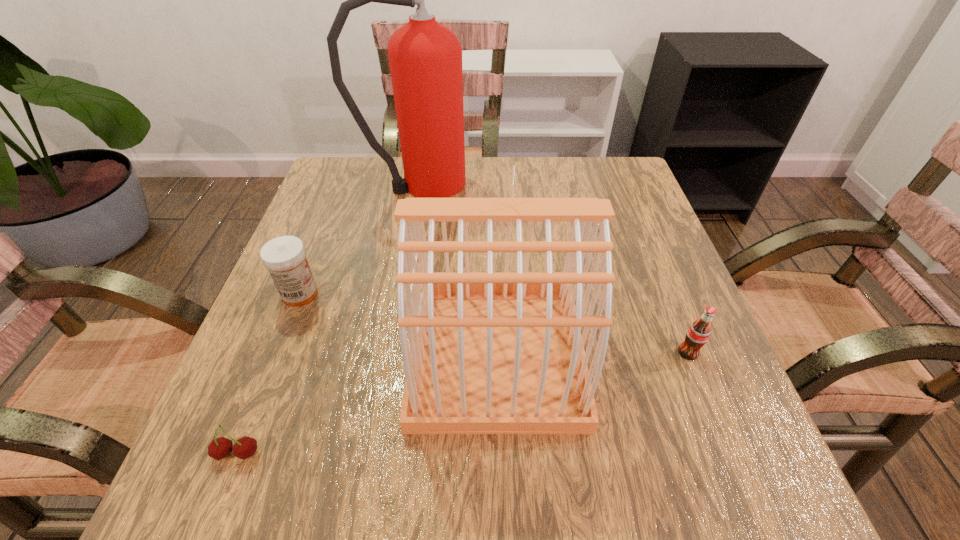
Where is `empty space between the soda and the second tallest object`? This screenshot has width=960, height=540. empty space between the soda and the second tallest object is located at coordinates click(x=592, y=354).

What are the coordinates of `vacant space that's between the medicine and the fire extinguisher` in the screenshot? It's located at (360, 239).

This screenshot has width=960, height=540. Find the location of `free spot between the rightmost object and the birdcage`. free spot between the rightmost object and the birdcage is located at coordinates (592, 354).

The width and height of the screenshot is (960, 540). What are the coordinates of `object that is the third closest to the medicine` in the screenshot? It's located at (425, 57).

Identify the location of object that is the third closest to the rightmost object. (285, 257).

This screenshot has height=540, width=960. I want to click on free space that satisfies the following two spatial constraints: 1. on the handle side of the farthest object; 2. on the front side of the medicine, so click(x=400, y=294).

Identify the location of free space that satisfies the following two spatial constraints: 1. with an open door on the birdcage; 2. on the surface of the shortest object. (499, 454).